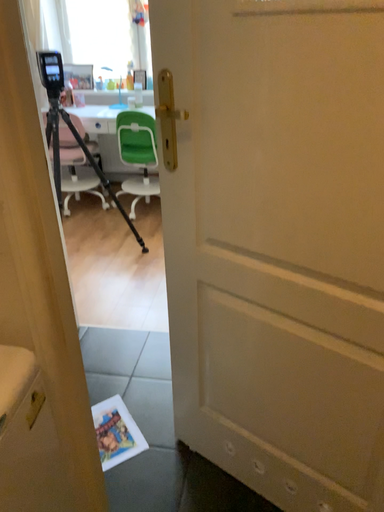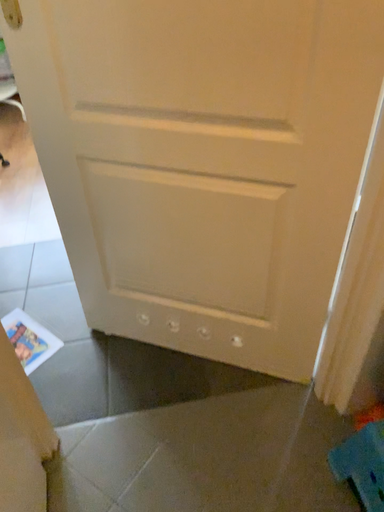
Question: Which way did the camera rotate in the video?

Choices:
 (A) rotated upward
 (B) rotated downward

Answer: (B)